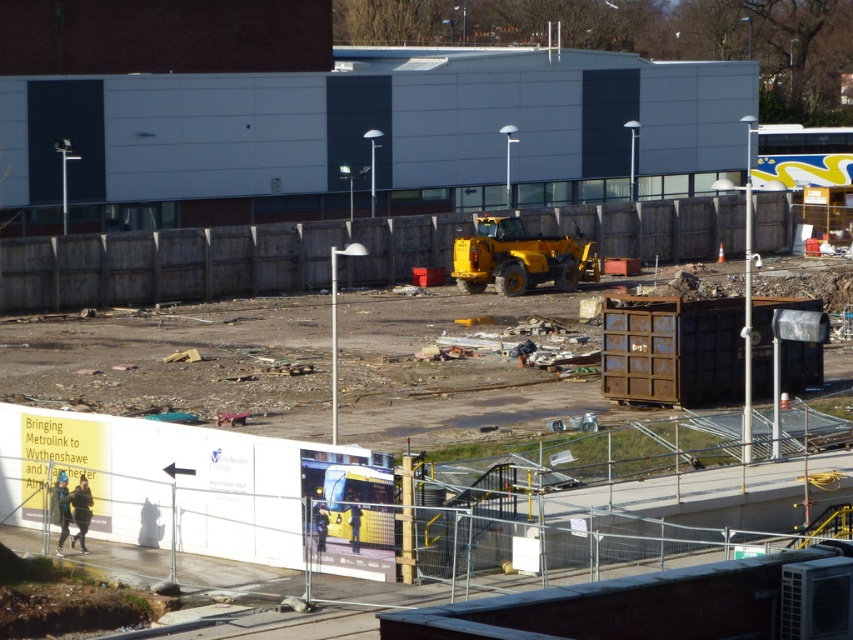
Based on the photo, you are a delivery driver who needs to unload a heavy load onto the construction site. The yellow rubber tire at center and the yellow rubber tractor at center are both potential unloading spots. However, the construction supervisor has specified that the unloading must occur at least 100 feet away from any other equipment. Based on the scene, can you safely unload at either of these spots?

The yellow rubber tire at center and the yellow rubber tractor at center are 86.99 feet apart, which is less than the required 100 feet distance. Therefore, you cannot safely unload at either spot as they are too close to each other.

You are a construction worker who needs to move the yellow rubber tractor at center. Can you move it without first moving the yellow rubber tire at center?

The yellow rubber tire at center is in front of the yellow rubber tractor at center, so you must move the tire first to access the tractor.

You are a delivery driver who needs to park your truck near the yellow rubber tire at center without blocking the arrow on the yellow banner pointing left. The minimum distance required between your truck and the arrow is 100 feet. Can you safely park your truck at the construction site?

The yellow rubber tire at center is 100.67 feet away from the arrow on the yellow banner pointing left. Since the required distance is 100 feet, parking the truck at the yellow rubber tire at center would satisfy the requirement as it exceeds the minimum distance.